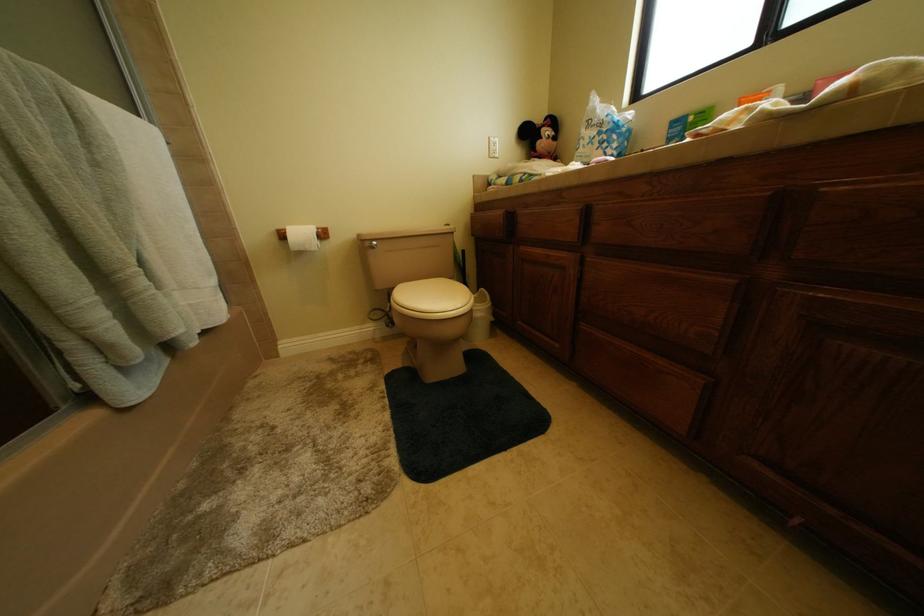
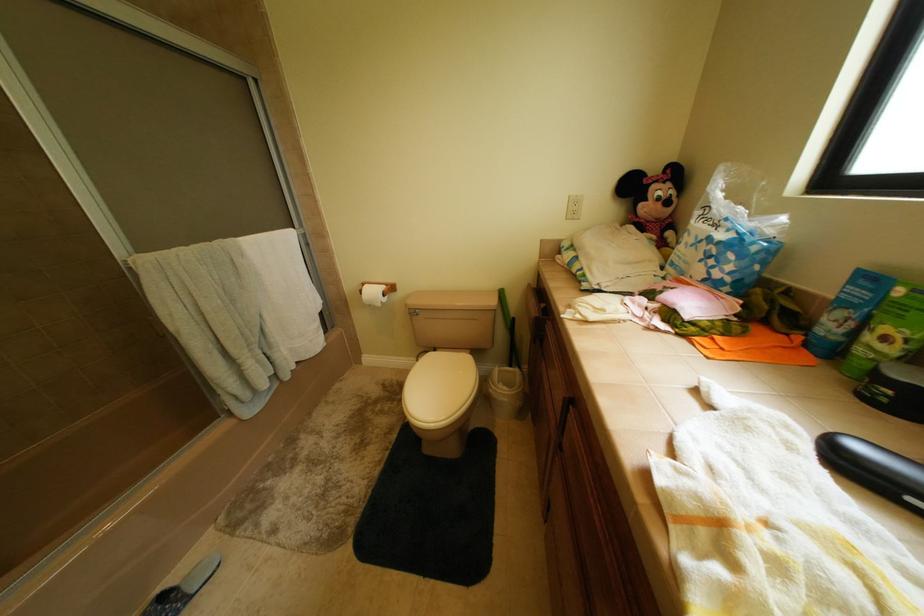
Question: The images are taken continuously from a first-person perspective. In which direction is your viewpoint rotating?

Choices:
 (A) Left
 (B) Right
 (C) Up
 (D) Down

Answer: (A)